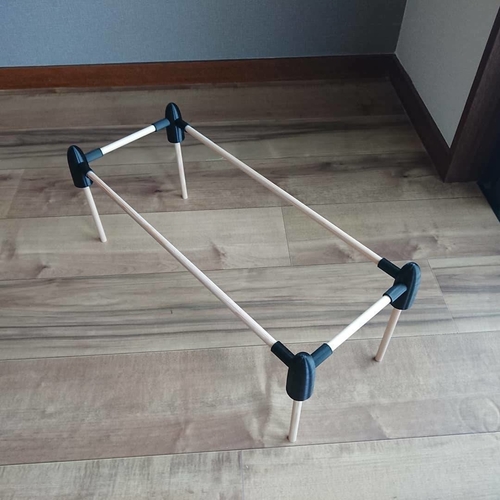
Image resolution: width=500 pixels, height=500 pixels. I want to click on white wall, so click(438, 70).